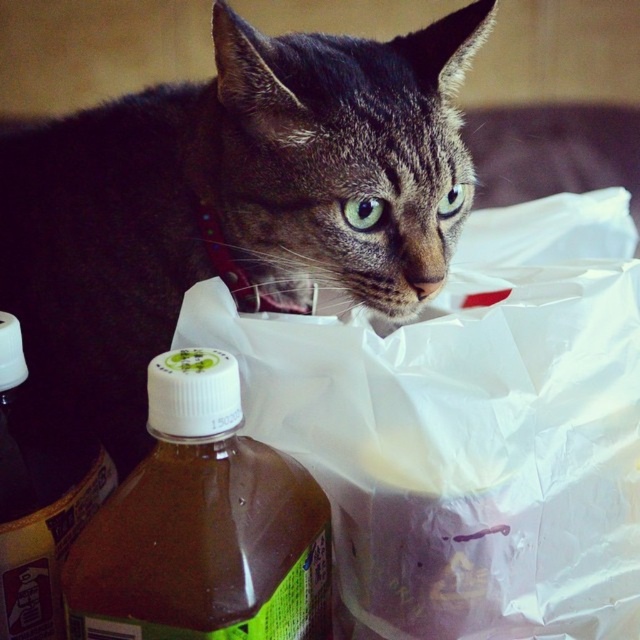
Does tabby fur cat at center appear over brown translucent bottle at lower left?

Indeed, tabby fur cat at center is positioned over brown translucent bottle at lower left.

Based on the photo, between tabby fur cat at center and brown translucent bottle at lower left, which one is positioned higher?

tabby fur cat at center

Is point (413, 225) positioned after point (179, 540)?

Yes, point (413, 225) is farther from viewer.

Where is `tabby fur cat at center`? tabby fur cat at center is located at coordinates (234, 198).

Is white plastic bag at center smaller than brown translucent bottle at lower left?

Actually, white plastic bag at center might be larger than brown translucent bottle at lower left.

Is point (604, 502) closer to viewer compared to point (202, 592)?

No, it is not.

Identify the location of white plastic bag at center. (468, 429).

Is brown translucent bottle at lower left below brown matte bottle at lower left?

Yes, brown translucent bottle at lower left is below brown matte bottle at lower left.

Which is in front, point (289, 506) or point (1, 579)?

Point (289, 506)

Is point (176, 524) less distant than point (33, 564)?

That is True.

Find the location of a particular element. This screenshot has width=640, height=640. brown translucent bottle at lower left is located at coordinates (202, 525).